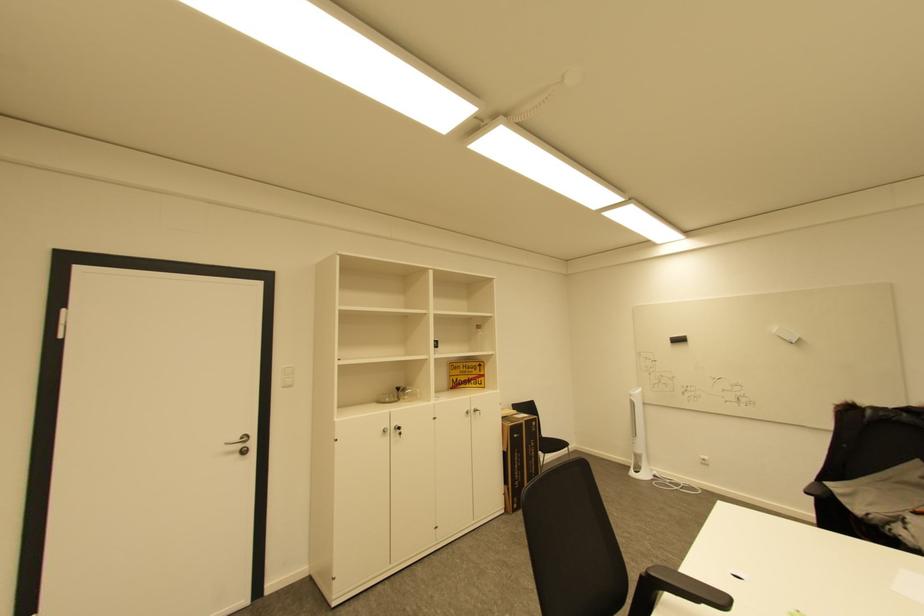
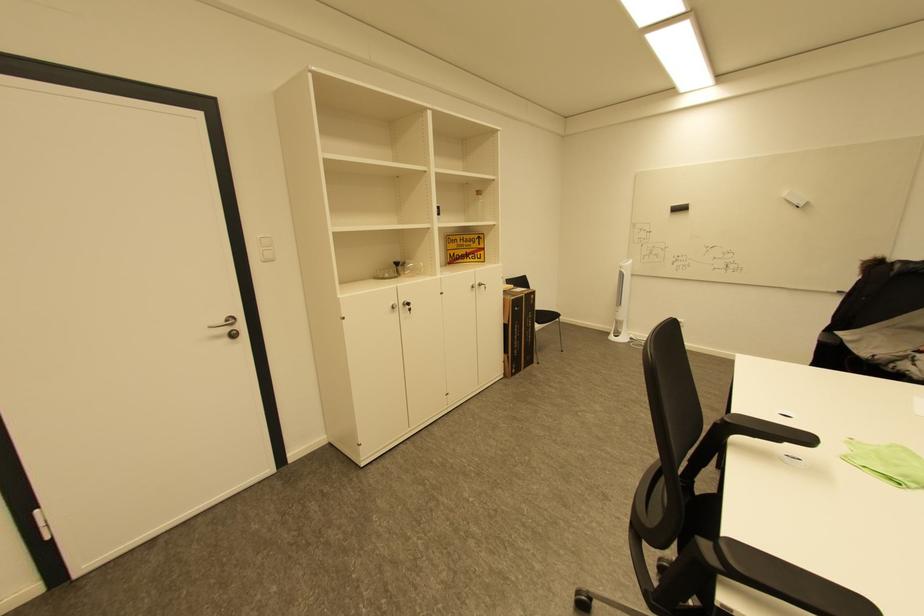
The point at (x=685, y=341) is marked in the first image. Where is the corresponding point in the second image?

(686, 209)